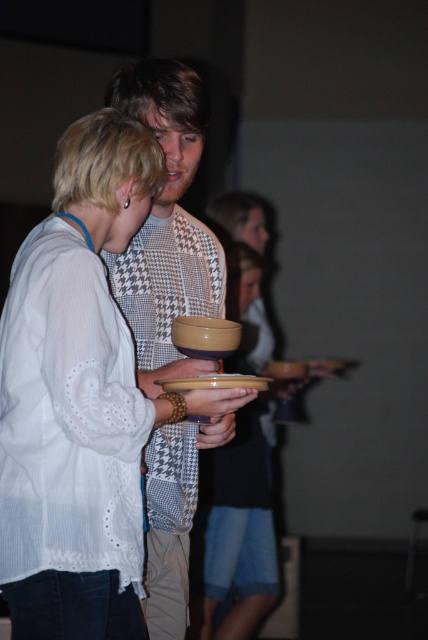
You are a photographer setting up for a group photo. You need to ensure that the houndstooth fabric shirt at center and the matte ceramic plate at center are both visible in the frame. Given their sizes, which object should you focus on to ensure both are in focus?

The houndstooth fabric shirt at center has a greater height compared to the matte ceramic plate at center, so focusing on the shirt will help ensure both are in focus since it is larger and occupies more space in the frame.

From the picture: You are at a dinner party and need to serve a large salad. You have two options at the center of the table, the matte yellow bowl at center and the matte ceramic plate at center. Which one should you choose?

The matte yellow bowl at center is bigger than the matte ceramic plate at center, so you should choose the matte yellow bowl at center to serve the large salad.

You are standing in the social gathering scene described. There is a point at coordinates point (x=169, y=260). If you want to move closer to this point, which direction should you move?

Since the point (x=169, y=260) is 8.26 feet away from the viewer, you should move forward towards the point to reduce the distance between you and the point.